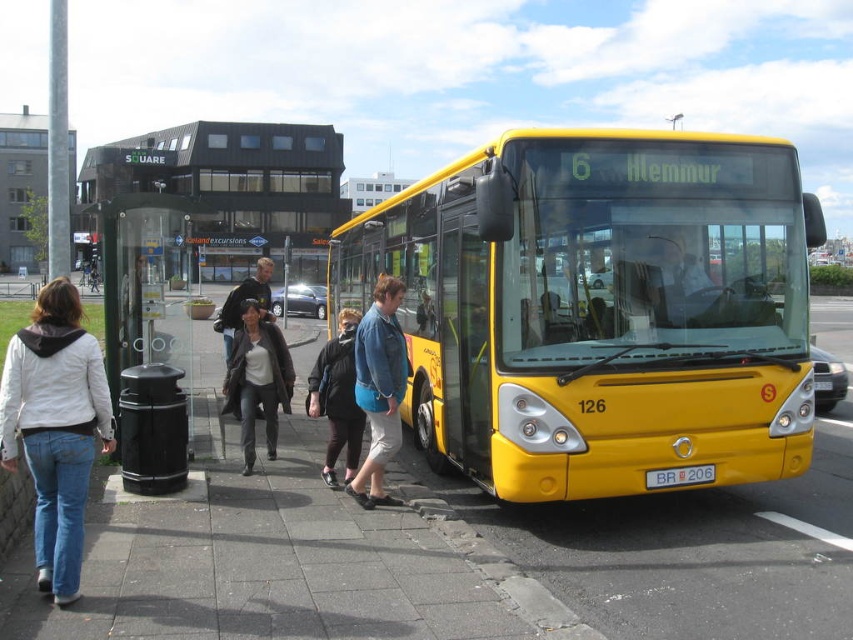
Which is above, yellow matte bus at center or denim jacket at center?

yellow matte bus at center is higher up.

Can you confirm if yellow matte bus at center is smaller than denim jacket at center?

Actually, yellow matte bus at center might be larger than denim jacket at center.

The width and height of the screenshot is (853, 640). What do you see at coordinates (601, 308) in the screenshot?
I see `yellow matte bus at center` at bounding box center [601, 308].

Where is `yellow matte bus at center`? The height and width of the screenshot is (640, 853). yellow matte bus at center is located at coordinates (601, 308).

Can you confirm if denim jeans at lower left is positioned below black fabric jacket at center?

Actually, denim jeans at lower left is above black fabric jacket at center.

Is denim jeans at lower left above black fabric jacket at center?

Indeed, denim jeans at lower left is positioned over black fabric jacket at center.

Is point (22, 346) more distant than point (323, 404)?

No.

At what (x,y) coordinates should I click in order to perform the action: click on denim jeans at lower left. Please return your answer as a coordinate pair (x, y). Image resolution: width=853 pixels, height=640 pixels. Looking at the image, I should click on (55, 428).

Who is more forward, (405, 202) or (329, 403)?

Point (329, 403)

Can you confirm if yellow matte bus at center is positioned above black fabric jacket at center?

Yes, yellow matte bus at center is above black fabric jacket at center.

Which is behind, point (607, 243) or point (345, 458)?

Point (345, 458)

This screenshot has width=853, height=640. Identify the location of yellow matte bus at center. (601, 308).